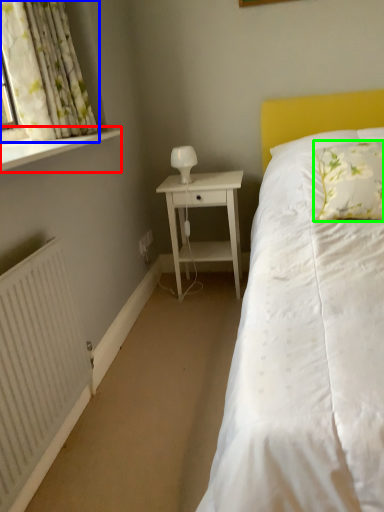
Question: Which object is positioned closest to window sill (highlighted by a red box)? Select from curtain (highlighted by a blue box) and pillow (highlighted by a green box).

Choices:
 (A) curtain
 (B) pillow

Answer: (A)